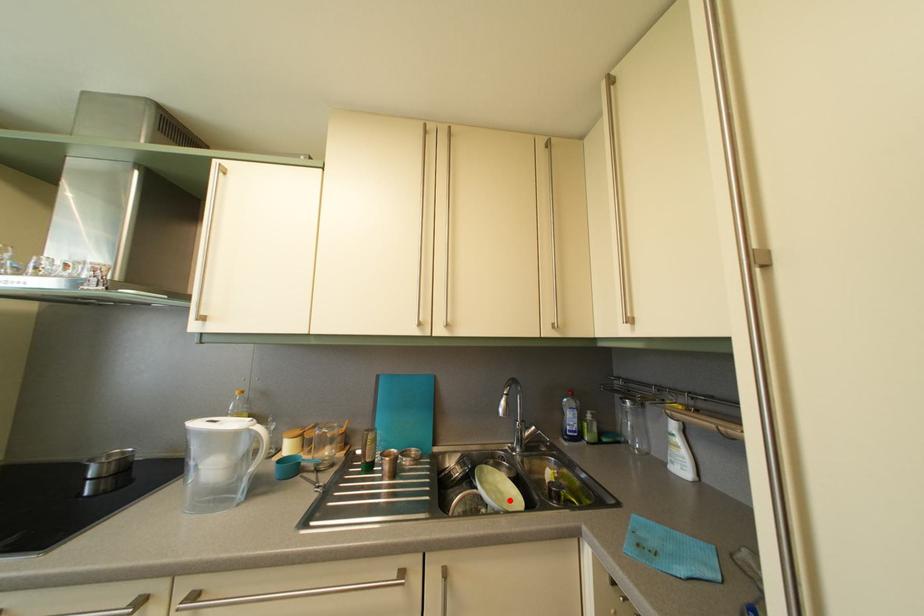
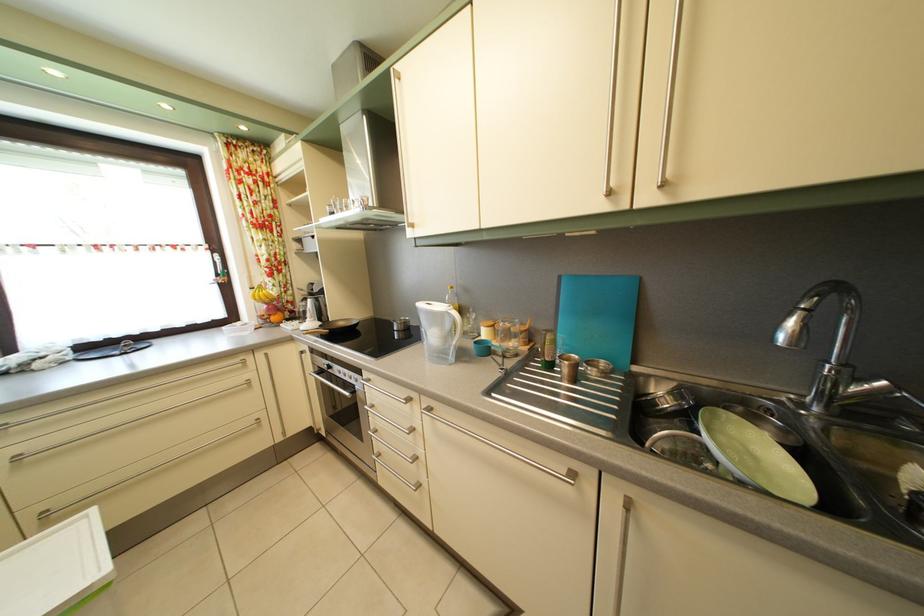
Locate, in the second image, the point that corresponds to the highlighted location in the first image.

(763, 466)